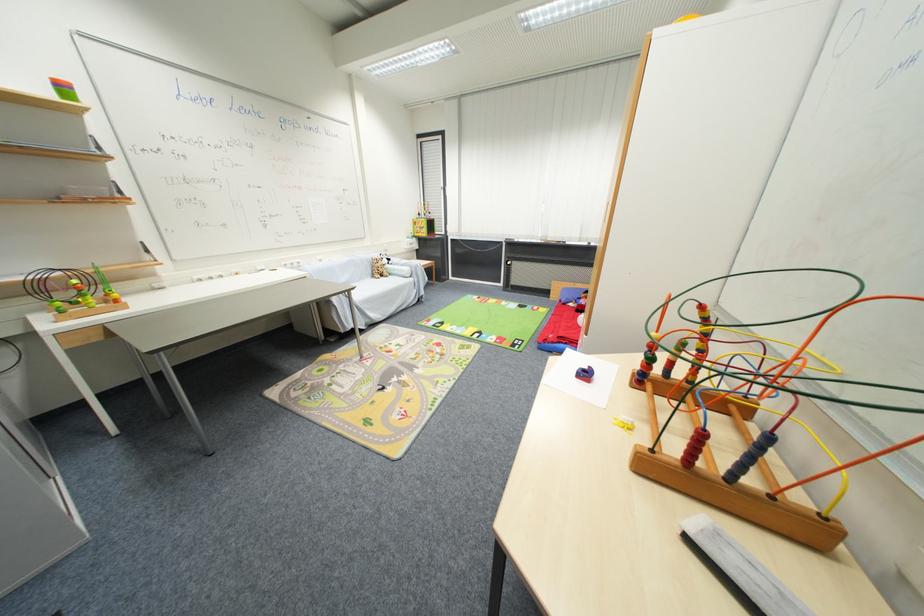
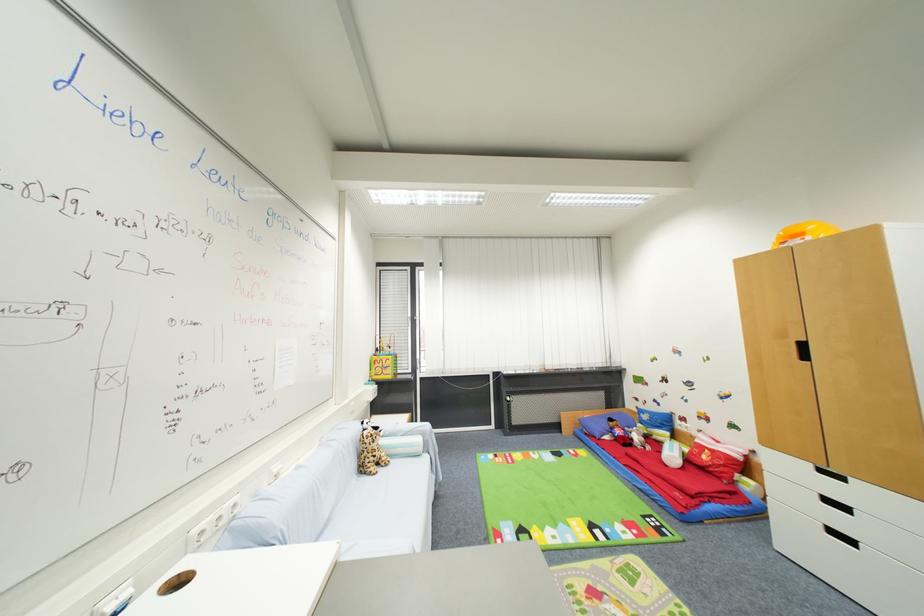
Where in the second image is the point corresponding to pixel 379 277 from the first image?

(367, 472)